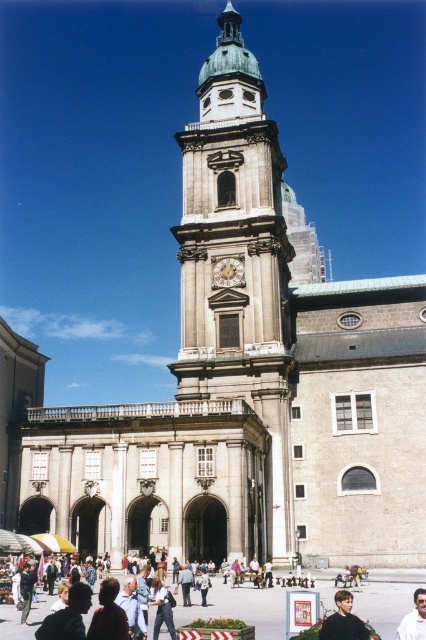
Can you confirm if brick paved square at center is positioned to the right of light blue jeans at center?

Indeed, brick paved square at center is positioned on the right side of light blue jeans at center.

Between point (325, 600) and point (150, 604), which one is positioned behind?

Point (325, 600)

Which is behind, point (371, 570) or point (155, 602)?

Point (371, 570)

This screenshot has height=640, width=426. Find the location of `brick paved square at center`. brick paved square at center is located at coordinates (239, 605).

How much distance is there between white shirt at center and gold ornate clock at center?

white shirt at center is 80.25 feet away from gold ornate clock at center.

At what (x,y) coordinates should I click in order to perform the action: click on white shirt at center. Please return your answer as a coordinate pair (x, y). Looking at the image, I should click on (414, 618).

Who is more forward, (x=419, y=595) or (x=215, y=266)?

Point (x=419, y=595) is in front.

Locate an element on the screen. This screenshot has height=640, width=426. white shirt at center is located at coordinates (414, 618).

Between black shirt at lower right and white shirt at center, which one is positioned lower?

white shirt at center is lower down.

Is point (344, 632) farther from camera compared to point (416, 637)?

No, it is in front of (416, 637).

Where is `black shirt at lower right`? black shirt at lower right is located at coordinates (342, 620).